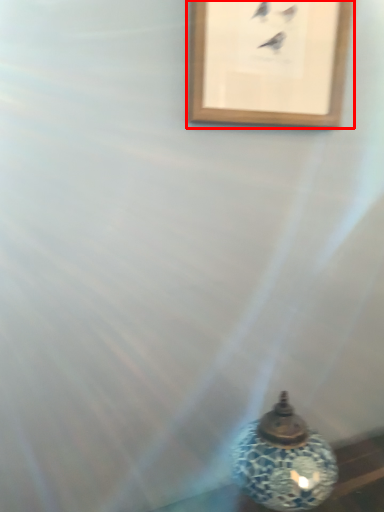
Question: From the image, what is the correct spatial relationship of picture frame (annotated by the red box) in relation to oil lamp?

Choices:
 (A) left
 (B) right

Answer: (A)